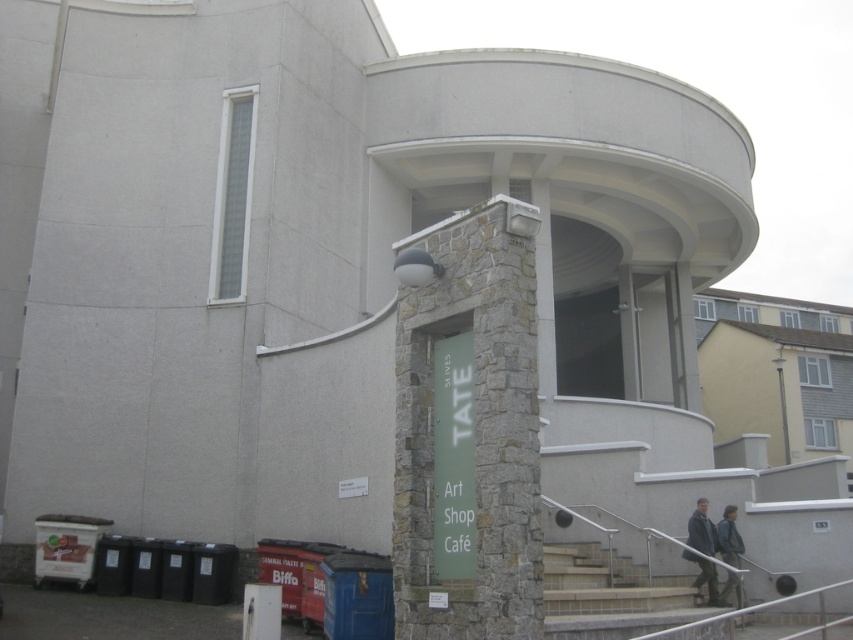
Does dark gray jacket at lower right have a greater width compared to green fabric jacket at lower right?

Yes, dark gray jacket at lower right is wider than green fabric jacket at lower right.

Is point (711, 540) more distant than point (730, 588)?

Yes.

What do you see at coordinates (701, 529) in the screenshot? This screenshot has height=640, width=853. I see `dark gray jacket at lower right` at bounding box center [701, 529].

I want to click on dark gray jacket at lower right, so click(x=701, y=529).

Who is positioned more to the right, smooth concrete stairs at lower center or dark gray jacket at lower right?

dark gray jacket at lower right

Does smooth concrete stairs at lower center lie in front of dark gray jacket at lower right?

Yes.

Image resolution: width=853 pixels, height=640 pixels. What are the coordinates of `smooth concrete stairs at lower center` in the screenshot? It's located at (608, 595).

Identify the location of smooth concrete stairs at lower center. The height and width of the screenshot is (640, 853). (608, 595).

Does smooth concrete stairs at lower center lie behind green fabric jacket at lower right?

No, it is in front of green fabric jacket at lower right.

Who is shorter, smooth concrete stairs at lower center or green fabric jacket at lower right?

green fabric jacket at lower right is shorter.

Locate an element on the screen. Image resolution: width=853 pixels, height=640 pixels. smooth concrete stairs at lower center is located at coordinates [608, 595].